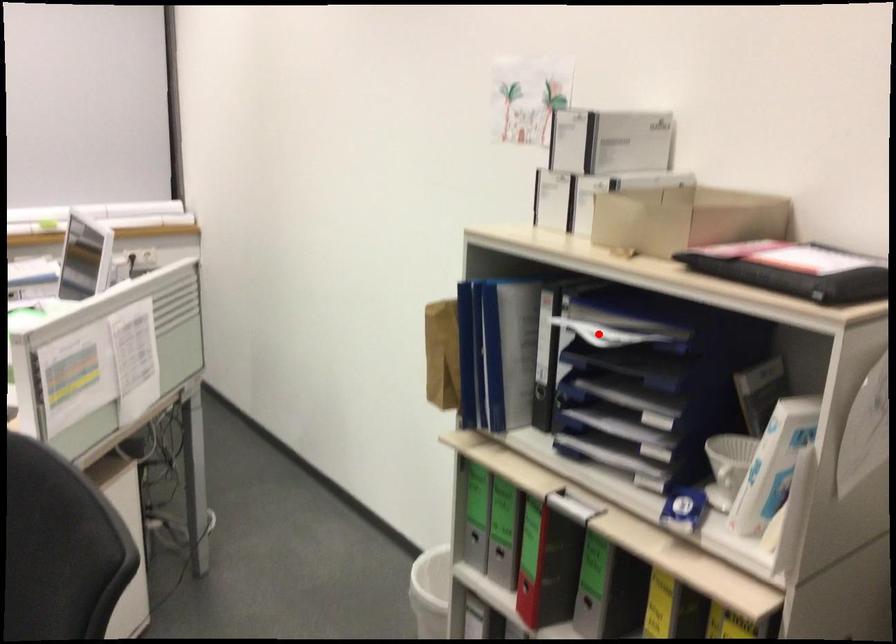
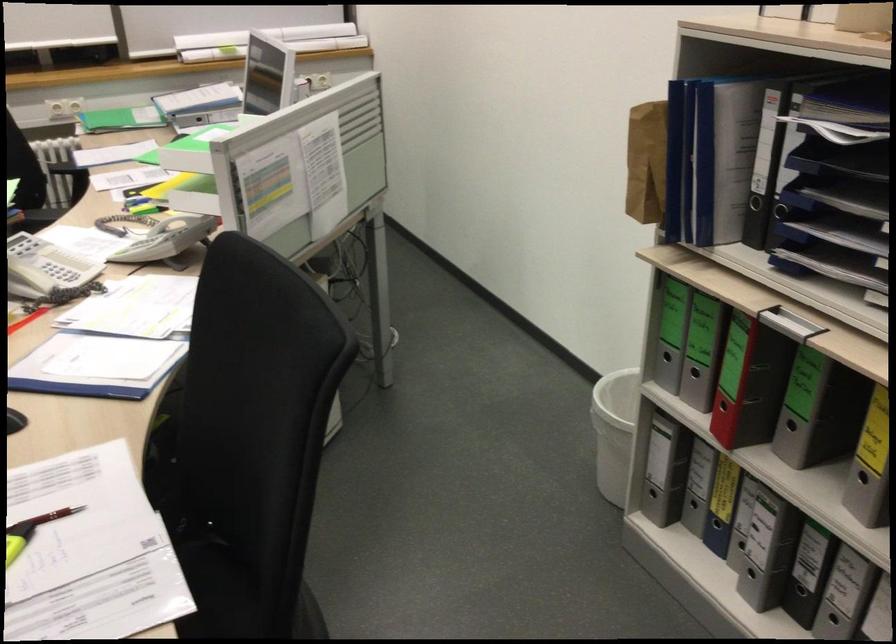
Find the pixel in the second image that matches the highlighted location in the first image.

(836, 129)